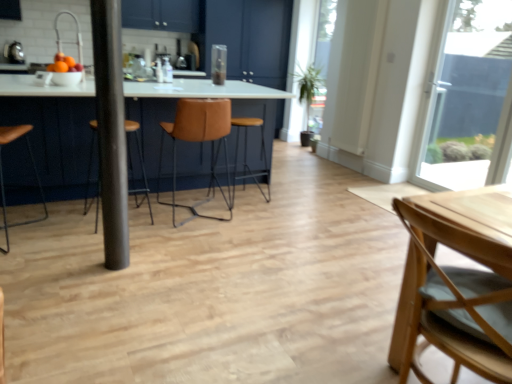
The image size is (512, 384). Identify the location of free space to the back side of metallic pole at center. (139, 247).